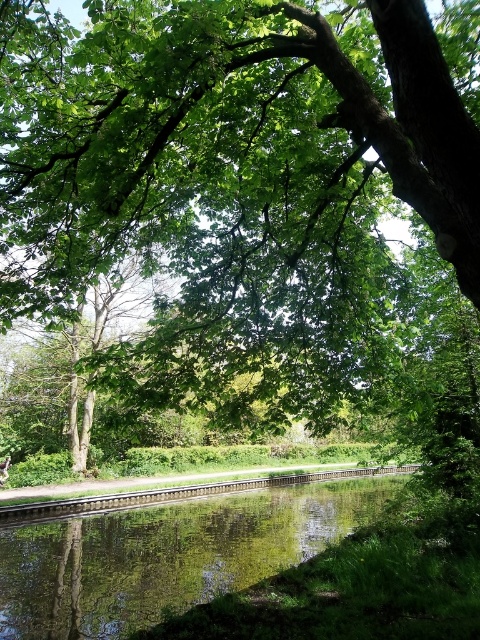
Is point (123, 604) positioned before point (68, 502)?

That is True.

Is green reflective water at center smaller than green wooden train track at center?

Actually, green reflective water at center might be larger than green wooden train track at center.

Measure the distance between point (57, 572) and camera.

Point (57, 572) is 29.34 feet away from camera.

Locate an element on the screen. This screenshot has height=640, width=480. green reflective water at center is located at coordinates (166, 554).